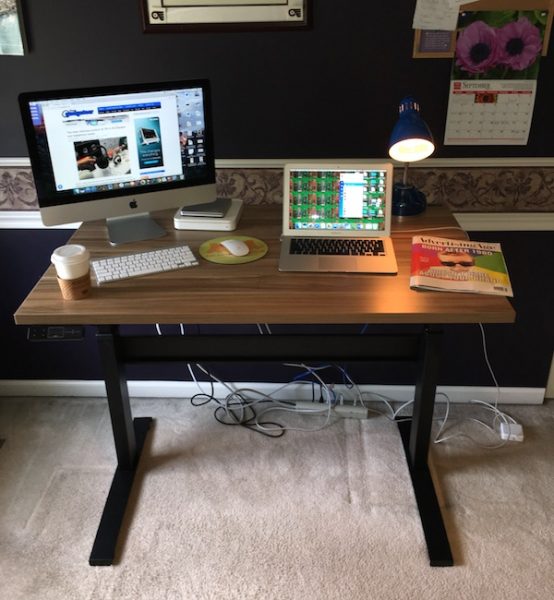
The image size is (554, 600). I want to click on wall, so click(285, 82).